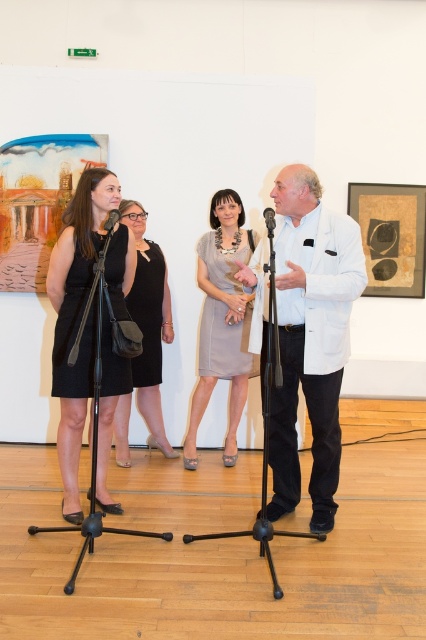
You are setting up equipment for an event in the art gallery. You have a camera that requires a tripod with a minimum width of 30 cm. Based on the scene description, can the black matte tripod at center or the black metal tripod at left accommodate your camera?

The black metal tripod at left has a greater width than the black matte tripod at center. Since the camera requires a minimum width of 30 cm, the black metal tripod at left is more likely to meet the requirement.

You are an event organizer checking the setup for an upcoming talk. You notice the matte black dress at left and the black matte microphone at left. Which object takes up more visual space in the scene?

The matte black dress at left is larger in size than the black matte microphone at left, so it takes up more visual space.

You are an art gallery visitor who wants to take a photo of the white smooth coat at center without the black metal tripod at left appearing in the frame. Based on their positions, is this possible?

Yes, because the white smooth coat at center is positioned to the right of the black metal tripod at left, so you can move to the right side of the tripod to capture the coat without the tripod in the shot.